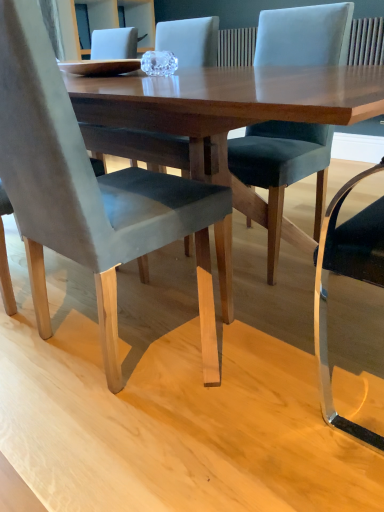
Question: Is velvet dark gray chair at center, the 1th chair in the right-to-left sequence, surrounding velvet grey chair at lower left, which is the second chair from right to left?

Choices:
 (A) yes
 (B) no

Answer: (B)

Question: Does velvet dark gray chair at center, the second chair viewed from the left, have a lesser width compared to velvet grey chair at lower left, which is the second chair from right to left?

Choices:
 (A) yes
 (B) no

Answer: (A)

Question: Considering the relative positions of velvet dark gray chair at center, the second chair viewed from the left, and velvet grey chair at lower left, which is the second chair from right to left, in the image provided, is velvet dark gray chair at center, the second chair viewed from the left, to the right of velvet grey chair at lower left, which is the second chair from right to left, from the viewer's perspective?

Choices:
 (A) no
 (B) yes

Answer: (B)

Question: Can you confirm if velvet dark gray chair at center, the second chair viewed from the left, is bigger than velvet grey chair at lower left, which is the 1th chair in left-to-right order?

Choices:
 (A) yes
 (B) no

Answer: (B)

Question: Can you confirm if velvet dark gray chair at center, the 1th chair in the right-to-left sequence, is shorter than velvet grey chair at lower left, which is the 1th chair in left-to-right order?

Choices:
 (A) yes
 (B) no

Answer: (A)

Question: Is there a large distance between velvet dark gray chair at center, the 1th chair in the right-to-left sequence, and velvet grey chair at lower left, which is the 1th chair in left-to-right order?

Choices:
 (A) no
 (B) yes

Answer: (A)

Question: Is velvet grey chair at lower left, which is the 1th chair in left-to-right order, facing towards velvet dark gray chair at center, the 1th chair in the right-to-left sequence?

Choices:
 (A) yes
 (B) no

Answer: (A)

Question: Is velvet grey chair at lower left, which is the 1th chair in left-to-right order, surrounding velvet dark gray chair at center, the 1th chair in the right-to-left sequence?

Choices:
 (A) no
 (B) yes

Answer: (A)

Question: From a real-world perspective, is velvet grey chair at lower left, which is the 1th chair in left-to-right order, below velvet dark gray chair at center, the second chair viewed from the left?

Choices:
 (A) yes
 (B) no

Answer: (A)

Question: Considering the relative sizes of velvet grey chair at lower left, which is the second chair from right to left, and velvet dark gray chair at center, the 1th chair in the right-to-left sequence, in the image provided, is velvet grey chair at lower left, which is the second chair from right to left, wider than velvet dark gray chair at center, the 1th chair in the right-to-left sequence,?

Choices:
 (A) no
 (B) yes

Answer: (B)

Question: Would you consider velvet grey chair at lower left, which is the 1th chair in left-to-right order, to be distant from velvet dark gray chair at center, the 1th chair in the right-to-left sequence?

Choices:
 (A) yes
 (B) no

Answer: (B)

Question: Can you confirm if velvet grey chair at lower left, which is the second chair from right to left, is taller than velvet dark gray chair at center, the second chair viewed from the left?

Choices:
 (A) yes
 (B) no

Answer: (A)

Question: From a real-world perspective, relative to velvet dark gray chair at center, the second chair viewed from the left, is velvet grey chair at lower left, which is the 1th chair in left-to-right order, vertically above or below?

Choices:
 (A) below
 (B) above

Answer: (A)